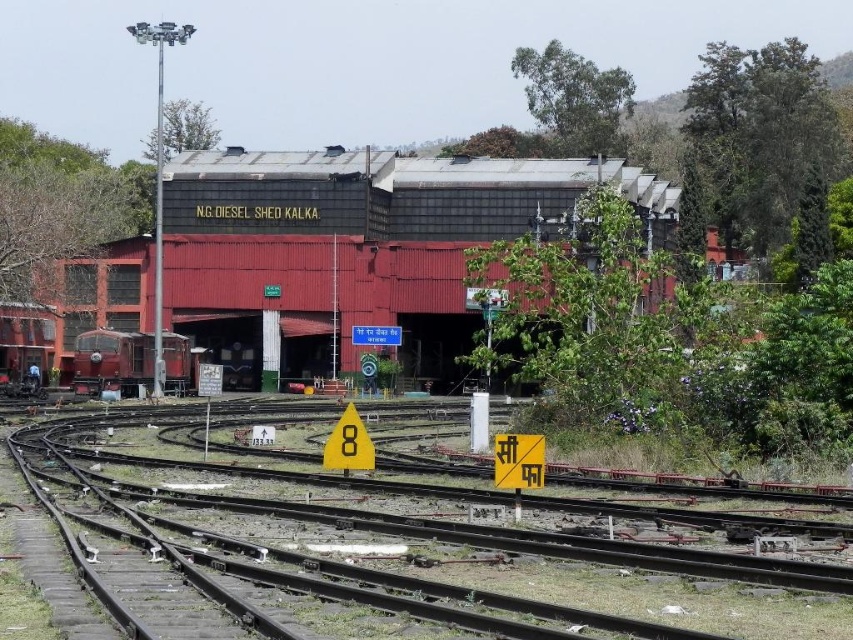
You are a railway worker standing at the entrance of the NG Diesel Shed Kalka. You need to inspect the black metal train track at center and the metallic red train shed at center. According to the scene, which object is positioned to the left of the other?

The black metal train track at center is to the left of the metallic red train shed at center.

You are a train conductor preparing to move the matte red train at center. There is a black metal train track at center in front of it. Can you safely move the train forward along the track without obstruction?

The black metal train track at center is in front of the matte red train at center, meaning the track is already positioned ahead of the train. Since the track is present in front, the matte red train at center can move forward along the black metal train track at center without any obstruction.

You are a railway worker standing at the NG Diesel Shed Kalka. You need to inspect two points along the tracks. The first point is at coordinates point (258, 300) and the second is at point (163, 355). Which point is closer to you when you start from the shed?

Point (258, 300) is further to the viewer than point (163, 355), so the second point at (163, 355) is closer to you.